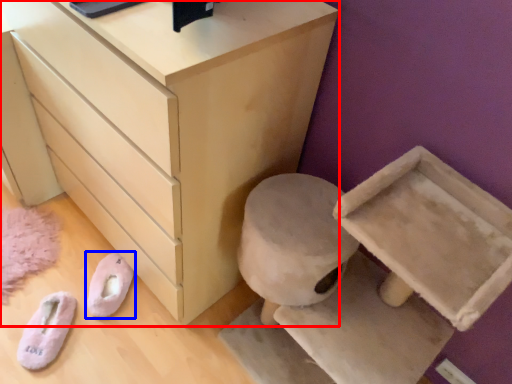
Question: Which point is closer to the camera, chest of drawers (highlighted by a red box) or footwear (highlighted by a blue box)?

Choices:
 (A) chest of drawers
 (B) footwear

Answer: (A)